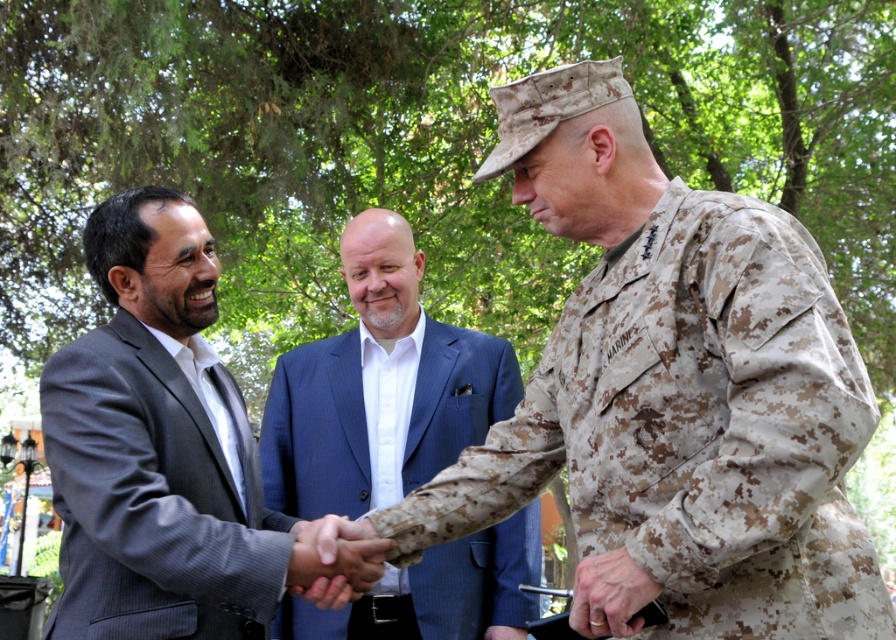
You are a photographer positioned at the origin point of the coordinate system. You want to take a photo of the blue suit at center. What are the coordinates where you should aim your camera?

The coordinates to aim the camera are at point (378, 388).